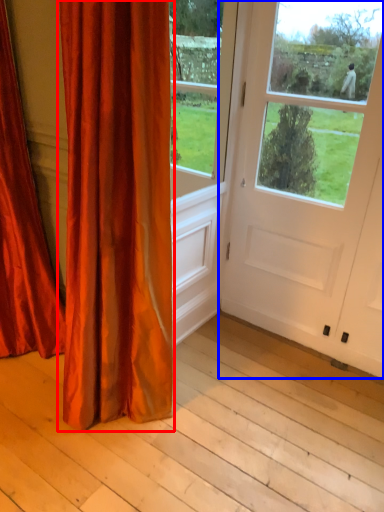
Question: Which point is closer to the camera, curtain (highlighted by a red box) or door (highlighted by a blue box)?

Choices:
 (A) curtain
 (B) door

Answer: (A)